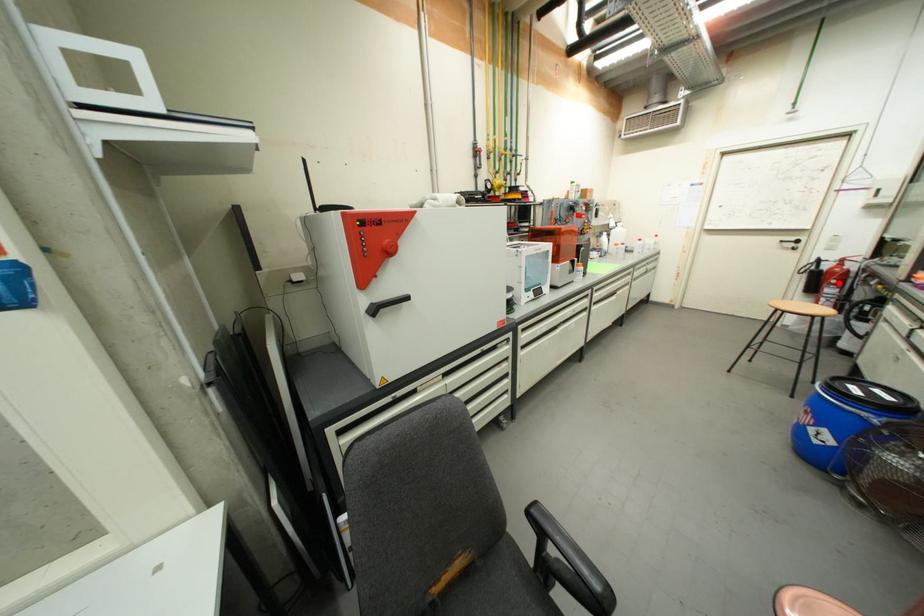
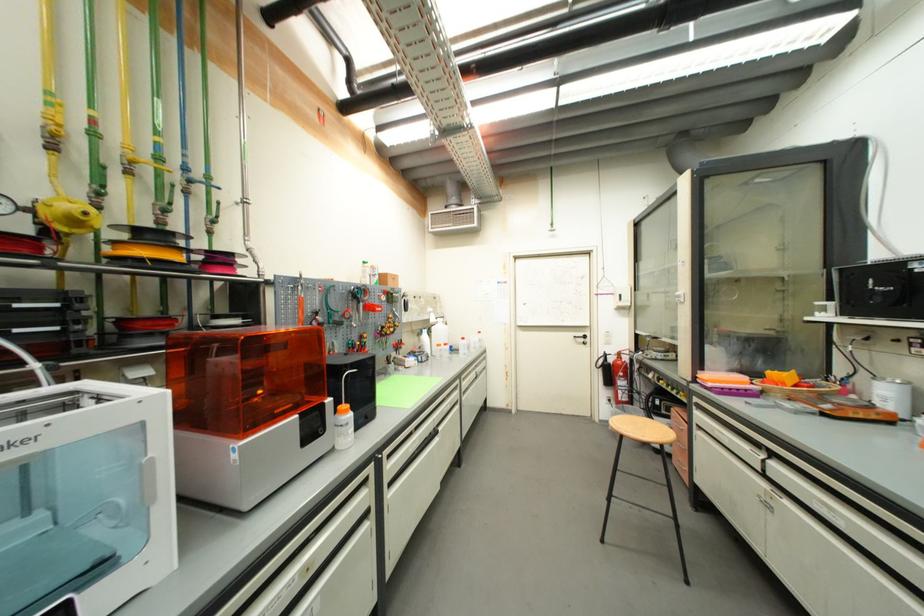
The point at the highlighted location is marked in the first image. Where is the corresponding point in the second image?

(626, 376)